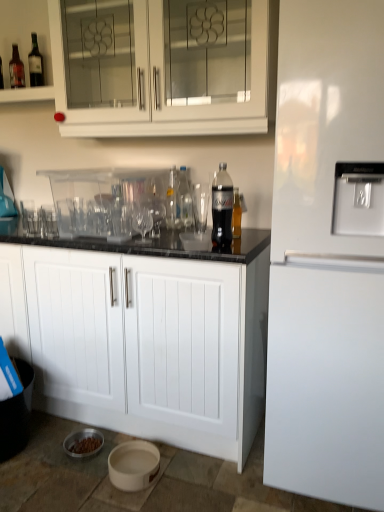
Question: Which direction should I rotate to look at transparent plastic bottle at center, the third bottle in the front-to-back sequence?

Choices:
 (A) left
 (B) right

Answer: (A)

Question: Does translucent plastic bottle at center, arranged as the third bottle when viewed from the back, touch transparent plastic bottle at center, the third bottle in the front-to-back sequence?

Choices:
 (A) yes
 (B) no

Answer: (B)

Question: Is translucent plastic bottle at center, arranged as the third bottle when viewed from the back, behind transparent plastic bottle at center, the 2th bottle in the right-to-left sequence?

Choices:
 (A) yes
 (B) no

Answer: (B)

Question: Considering the relative sizes of translucent plastic bottle at center, the 1th bottle viewed from the front, and transparent plastic bottle at center, the 2th bottle in the right-to-left sequence, in the image provided, is translucent plastic bottle at center, the 1th bottle viewed from the front, taller than transparent plastic bottle at center, the 2th bottle in the right-to-left sequence,?

Choices:
 (A) yes
 (B) no

Answer: (B)

Question: From a real-world perspective, is translucent plastic bottle at center, which is counted as the first bottle, starting from the right, over transparent plastic bottle at center, the first bottle positioned from the back?

Choices:
 (A) no
 (B) yes

Answer: (A)

Question: Does translucent plastic bottle at center, arranged as the third bottle when viewed from the back, appear on the left side of transparent plastic bottle at center, the 2th bottle in the right-to-left sequence?

Choices:
 (A) no
 (B) yes

Answer: (A)

Question: Does translucent plastic bottle at center, which is counted as the third bottle, starting from the left, turn towards transparent plastic bottle at center, the first bottle positioned from the back?

Choices:
 (A) no
 (B) yes

Answer: (A)

Question: Considering the relative sizes of transparent plastic drinking straw at center, arranged as the 2th drinking straw when viewed from the back, and clear glass bottle at center, the 1th bottle when ordered from left to right, in the image provided, is transparent plastic drinking straw at center, arranged as the 2th drinking straw when viewed from the back, taller than clear glass bottle at center, the 1th bottle when ordered from left to right,?

Choices:
 (A) yes
 (B) no

Answer: (A)

Question: Is transparent plastic drinking straw at center, placed as the second drinking straw when sorted from top to bottom, not inside clear glass bottle at center, the 2th bottle from the front?

Choices:
 (A) no
 (B) yes

Answer: (B)

Question: From the image's perspective, is transparent plastic drinking straw at center, marked as the first drinking straw in a bottom-to-top arrangement, located beneath clear glass bottle at center, the 2th bottle from the front?

Choices:
 (A) yes
 (B) no

Answer: (A)

Question: Can you confirm if transparent plastic drinking straw at center, marked as the first drinking straw in a bottom-to-top arrangement, is thinner than clear glass bottle at center, the 2th bottle from the back?

Choices:
 (A) yes
 (B) no

Answer: (B)

Question: Considering the relative sizes of transparent plastic drinking straw at center, which is the 2th drinking straw in left-to-right order, and clear glass bottle at center, the 1th bottle when ordered from left to right, in the image provided, is transparent plastic drinking straw at center, which is the 2th drinking straw in left-to-right order, wider than clear glass bottle at center, the 1th bottle when ordered from left to right,?

Choices:
 (A) no
 (B) yes

Answer: (B)

Question: From a real-world perspective, is transparent plastic drinking straw at center, marked as the first drinking straw in a bottom-to-top arrangement, over clear glass bottle at center, the 1th bottle when ordered from left to right?

Choices:
 (A) no
 (B) yes

Answer: (B)

Question: Can you confirm if clear glass bottle at center, which ranks as the third bottle in right-to-left order, is thinner than white glossy refrigerator at right?

Choices:
 (A) no
 (B) yes

Answer: (B)